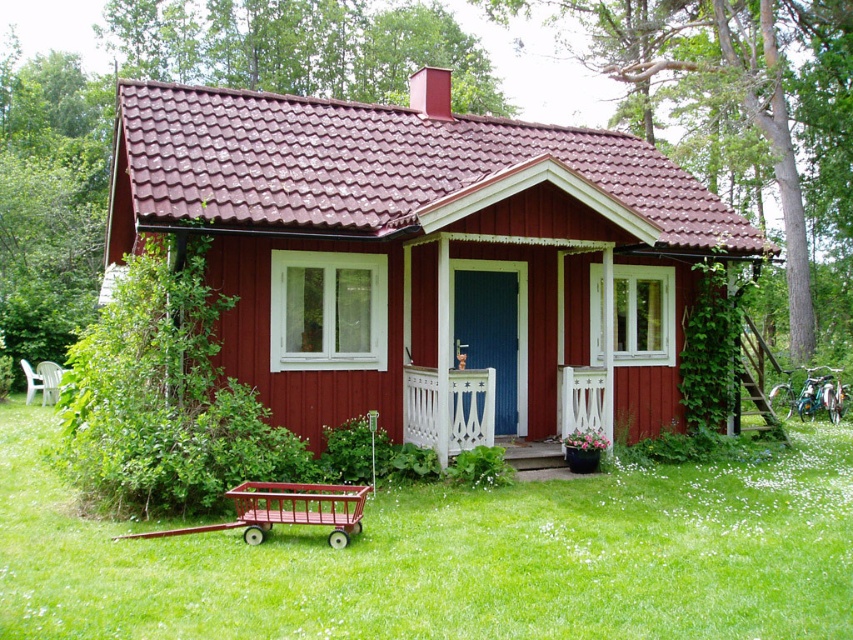
Question: Considering the real-world distances, which object is closest to the white painted wood porch at center?

Choices:
 (A) metallic red wagon at lower left
 (B) smooth wooden cottage at center
 (C) green grass at lower center

Answer: (C)

Question: Does smooth wooden cottage at center appear on the right side of white painted wood porch at center?

Choices:
 (A) no
 (B) yes

Answer: (A)

Question: Which object is closer to the camera taking this photo?

Choices:
 (A) white painted wood porch at center
 (B) green grass at lower center

Answer: (B)

Question: Which point is closer to the camera?

Choices:
 (A) (134, 532)
 (B) (213, 113)

Answer: (A)

Question: Is smooth wooden cottage at center wider than green grass at lower center?

Choices:
 (A) yes
 (B) no

Answer: (A)

Question: Is smooth wooden cottage at center to the left of metallic red wagon at lower left from the viewer's perspective?

Choices:
 (A) yes
 (B) no

Answer: (B)